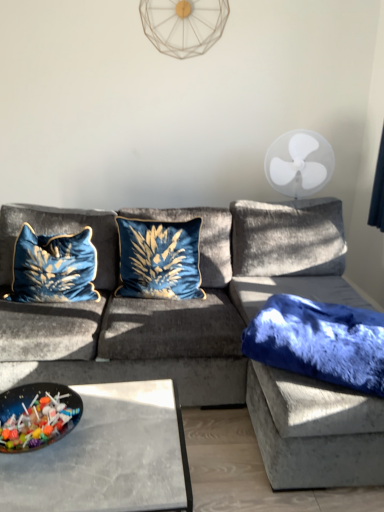
Where is `fuzzy blue blanket at right, which ranks as the first pillow in right-to-left order`? fuzzy blue blanket at right, which ranks as the first pillow in right-to-left order is located at coordinates (319, 342).

This screenshot has height=512, width=384. What do you see at coordinates (183, 25) in the screenshot? I see `white plastic fan at upper center, the 2th mechanical fan positioned from the bottom` at bounding box center [183, 25].

The height and width of the screenshot is (512, 384). Describe the element at coordinates (159, 259) in the screenshot. I see `velvet blue pillow at center, positioned as the second pillow in right-to-left order` at that location.

What do you see at coordinates (53, 267) in the screenshot? I see `velvet blue pillow at left, the third pillow viewed from the right` at bounding box center [53, 267].

Image resolution: width=384 pixels, height=512 pixels. Describe the element at coordinates (210, 331) in the screenshot. I see `velvet blue couch at center` at that location.

Measure the distance between point (250, 240) and camera.

Point (250, 240) is 2.42 meters from camera.

Identify the location of fuzzy blue blanket at right, which ranks as the first pillow in right-to-left order. (319, 342).

Locate an element on the screen. The image size is (384, 512). the 1st pillow below the white plastic fan at upper right, acting as the first mechanical fan starting from the bottom (from the image's perspective) is located at coordinates (159, 259).

Is white plastic fan at upper right, the 2th mechanical fan from the top, situated inside velvet blue pillow at center, positioned as the second pillow in right-to-left order, or outside?

white plastic fan at upper right, the 2th mechanical fan from the top, cannot be found inside velvet blue pillow at center, positioned as the second pillow in right-to-left order.

Considering the positions of points (307, 180) and (116, 219), is point (307, 180) farther from camera compared to point (116, 219)?

Yes, point (307, 180) is farther from viewer.

From the image's perspective, relative to velvet blue pillow at center, positioned as the second pillow in right-to-left order, is white plastic fan at upper right, the 2th mechanical fan from the top, above or below?

white plastic fan at upper right, the 2th mechanical fan from the top, is above velvet blue pillow at center, positioned as the second pillow in right-to-left order.

Can you confirm if fuzzy blue blanket at right, which ranks as the first pillow in right-to-left order, is positioned to the left of white plastic fan at upper right, the 2th mechanical fan from the top?

Yes, fuzzy blue blanket at right, which ranks as the first pillow in right-to-left order, is to the left of white plastic fan at upper right, the 2th mechanical fan from the top.

Can you tell me how much fuzzy blue blanket at right, which ranks as the first pillow in right-to-left order, and white plastic fan at upper right, the first mechanical fan when ordered from right to left, differ in facing direction?

The facing directions of fuzzy blue blanket at right, which ranks as the first pillow in right-to-left order, and white plastic fan at upper right, the first mechanical fan when ordered from right to left, are 5.12 degrees apart.

From a real-world perspective, relative to white plastic fan at upper right, which is the second mechanical fan from left to right, is fuzzy blue blanket at right, which ranks as the first pillow in right-to-left order, vertically above or below?

fuzzy blue blanket at right, which ranks as the first pillow in right-to-left order, is situated lower than white plastic fan at upper right, which is the second mechanical fan from left to right, in the real world.

Which point is more distant from viewer, (x=299, y=347) or (x=317, y=164)?

The point (x=317, y=164) is behind.

Is velvet blue pillow at left, which ranks as the first pillow in left-to-right order, bigger than white plastic fan at upper right, the first mechanical fan when ordered from right to left?

No, velvet blue pillow at left, which ranks as the first pillow in left-to-right order, is not bigger than white plastic fan at upper right, the first mechanical fan when ordered from right to left.

Is velvet blue pillow at left, the third pillow viewed from the right, with white plastic fan at upper right, the first mechanical fan when ordered from right to left?

velvet blue pillow at left, the third pillow viewed from the right, and white plastic fan at upper right, the first mechanical fan when ordered from right to left, are clearly separated.

Between velvet blue pillow at left, which ranks as the first pillow in left-to-right order, and white plastic fan at upper right, the 2th mechanical fan from the top, which one appears on the right side from the viewer's perspective?

white plastic fan at upper right, the 2th mechanical fan from the top.

Which of these two, velvet blue pillow at left, the third pillow viewed from the right, or white plastic fan at upper right, the first mechanical fan when ordered from right to left, is wider?

Wider between the two is white plastic fan at upper right, the first mechanical fan when ordered from right to left.

Can you see white plastic fan at upper center, the first mechanical fan from the left, touching fuzzy blue blanket at right, which ranks as the first pillow in right-to-left order?

There is a gap between white plastic fan at upper center, the first mechanical fan from the left, and fuzzy blue blanket at right, which ranks as the first pillow in right-to-left order.

Can you confirm if white plastic fan at upper center, the first mechanical fan from the left, is thinner than fuzzy blue blanket at right, marked as the 3th pillow in a left-to-right arrangement?

Correct, the width of white plastic fan at upper center, the first mechanical fan from the left, is less than that of fuzzy blue blanket at right, marked as the 3th pillow in a left-to-right arrangement.

Is white plastic fan at upper center, placed as the 1th mechanical fan when sorted from top to bottom, facing away from fuzzy blue blanket at right, marked as the 3th pillow in a left-to-right arrangement?

white plastic fan at upper center, placed as the 1th mechanical fan when sorted from top to bottom, is not turned away from fuzzy blue blanket at right, marked as the 3th pillow in a left-to-right arrangement.

Considering the relative sizes of white plastic fan at upper center, placed as the 1th mechanical fan when sorted from top to bottom, and fuzzy blue blanket at right, marked as the 3th pillow in a left-to-right arrangement, in the image provided, is white plastic fan at upper center, placed as the 1th mechanical fan when sorted from top to bottom, bigger than fuzzy blue blanket at right, marked as the 3th pillow in a left-to-right arrangement,?

Actually, white plastic fan at upper center, placed as the 1th mechanical fan when sorted from top to bottom, might be smaller than fuzzy blue blanket at right, marked as the 3th pillow in a left-to-right arrangement.

From the image's perspective, is velvet blue couch at center above glossy plastic bowl of candy at lower left?

Yes, from the image's perspective, velvet blue couch at center is over glossy plastic bowl of candy at lower left.

From a real-world perspective, which object stands above the other?

glossy plastic bowl of candy at lower left, from a real-world perspective.

Considering the relative sizes of velvet blue couch at center and glossy plastic bowl of candy at lower left in the image provided, is velvet blue couch at center smaller than glossy plastic bowl of candy at lower left?

No.

In the scene shown: Can you confirm if velvet blue couch at center is taller than glossy plastic bowl of candy at lower left?

Correct, velvet blue couch at center is much taller as glossy plastic bowl of candy at lower left.

Find the location of a particular element. studio couch in front of the white plastic fan at upper right, acting as the first mechanical fan starting from the bottom is located at coordinates (210, 331).

In the scene shown: From a real-world perspective, is white plastic fan at upper right, the 2th mechanical fan from the top, on velvet blue couch at center?

Yes, from a real-world perspective, white plastic fan at upper right, the 2th mechanical fan from the top, is above velvet blue couch at center.

Between white plastic fan at upper right, which is the second mechanical fan from left to right, and velvet blue couch at center, which one appears on the right side from the viewer's perspective?

white plastic fan at upper right, which is the second mechanical fan from left to right, is more to the right.

Is white plastic fan at upper right, acting as the first mechanical fan starting from the bottom, next to velvet blue couch at center?

No, white plastic fan at upper right, acting as the first mechanical fan starting from the bottom, is not beside velvet blue couch at center.

Is glossy plastic bowl of candy at lower left wider or thinner than white plastic fan at upper right, the first mechanical fan when ordered from right to left?

Considering their sizes, glossy plastic bowl of candy at lower left looks slimmer than white plastic fan at upper right, the first mechanical fan when ordered from right to left.

How different are the orientations of glossy plastic bowl of candy at lower left and white plastic fan at upper right, the first mechanical fan when ordered from right to left, in degrees?

21.9 degrees.

Which of these two, glossy plastic bowl of candy at lower left or white plastic fan at upper right, acting as the first mechanical fan starting from the bottom, is smaller?

Smaller between the two is glossy plastic bowl of candy at lower left.

Are glossy plastic bowl of candy at lower left and white plastic fan at upper right, the first mechanical fan when ordered from right to left, making contact?

No, glossy plastic bowl of candy at lower left is not making contact with white plastic fan at upper right, the first mechanical fan when ordered from right to left.

You are a GUI agent. You are given a task and a screenshot of the screen. Output one action in this format:
    pyautogui.click(x=<x>, y=<y>)
    Task: Click on the 1st pillow in front of the white plastic fan at upper right, which is the second mechanical fan from left to right, starting your count from the anchor
    
    Given the screenshot: What is the action you would take?
    pyautogui.click(x=159, y=259)

The width and height of the screenshot is (384, 512). Find the location of `the 1st mechanical fan behind when counting from the fuzzy blue blanket at right, marked as the 3th pillow in a left-to-right arrangement`. the 1st mechanical fan behind when counting from the fuzzy blue blanket at right, marked as the 3th pillow in a left-to-right arrangement is located at coordinates (299, 163).

Which object lies nearer to the anchor point white plastic fan at upper center, the 2th mechanical fan from the right, velvet blue pillow at center, positioned as the second pillow in right-to-left order, or white plastic fan at upper right, the 2th mechanical fan from the top?

white plastic fan at upper right, the 2th mechanical fan from the top, lies closer to white plastic fan at upper center, the 2th mechanical fan from the right, than the other object.

Estimate the real-world distances between objects in this image. Which object is further from fuzzy blue blanket at right, marked as the 3th pillow in a left-to-right arrangement, velvet blue pillow at left, which ranks as the first pillow in left-to-right order, or glossy plastic bowl of candy at lower left?

The object further to fuzzy blue blanket at right, marked as the 3th pillow in a left-to-right arrangement, is velvet blue pillow at left, which ranks as the first pillow in left-to-right order.

From the image, which object appears to be farther from velvet blue couch at center, velvet blue pillow at left, which ranks as the first pillow in left-to-right order, or white plastic fan at upper center, the 2th mechanical fan positioned from the bottom?

white plastic fan at upper center, the 2th mechanical fan positioned from the bottom, is further to velvet blue couch at center.

Based on their spatial positions, is white plastic fan at upper center, the 2th mechanical fan positioned from the bottom, or fuzzy blue blanket at right, marked as the 3th pillow in a left-to-right arrangement, further from velvet blue pillow at center, the second pillow when ordered from left to right?

Answer: Among the two, white plastic fan at upper center, the 2th mechanical fan positioned from the bottom, is located further to velvet blue pillow at center, the second pillow when ordered from left to right.

When comparing their distances from velvet blue pillow at center, the second pillow when ordered from left to right, does white plastic fan at upper center, the 2th mechanical fan positioned from the bottom, or velvet blue couch at center seem closer?

velvet blue couch at center.

From the image, which object appears to be nearer to white plastic fan at upper right, which is the second mechanical fan from left to right, glossy plastic bowl of candy at lower left or velvet blue couch at center?

The object closer to white plastic fan at upper right, which is the second mechanical fan from left to right, is velvet blue couch at center.

Considering their positions, is white plastic fan at upper center, the 2th mechanical fan from the right, positioned closer to velvet blue pillow at center, the second pillow when ordered from left to right, than glossy plastic bowl of candy at lower left?

glossy plastic bowl of candy at lower left is closer to velvet blue pillow at center, the second pillow when ordered from left to right.

Estimate the real-world distances between objects in this image. Which object is further from velvet blue pillow at left, which ranks as the first pillow in left-to-right order, velvet blue pillow at center, positioned as the second pillow in right-to-left order, or white plastic fan at upper center, the 2th mechanical fan from the right?

Among the two, white plastic fan at upper center, the 2th mechanical fan from the right, is located further to velvet blue pillow at left, which ranks as the first pillow in left-to-right order.

You are a GUI agent. You are given a task and a screenshot of the screen. Output one action in this format:
    pyautogui.click(x=<x>, y=<y>)
    Task: Click on the pillow between glossy plastic bowl of candy at lower left and fuzzy blue blanket at right, which ranks as the first pillow in right-to-left order, in the horizontal direction
    The width and height of the screenshot is (384, 512).
    Given the screenshot: What is the action you would take?
    pos(159,259)

At what (x,y) coordinates should I click in order to perform the action: click on food located between velvet blue pillow at left, the third pillow viewed from the right, and fuzzy blue blanket at right, marked as the 3th pillow in a left-to-right arrangement, in the left-right direction. Please return your answer as a coordinate pair (x, y). The height and width of the screenshot is (512, 384). Looking at the image, I should click on (37, 416).

In order to click on studio couch between glossy plastic bowl of candy at lower left and velvet blue pillow at left, the third pillow viewed from the right, in the front-back direction in this screenshot , I will do `click(210, 331)`.

I want to click on studio couch that lies between white plastic fan at upper center, the 2th mechanical fan from the right, and glossy plastic bowl of candy at lower left from top to bottom, so click(x=210, y=331).